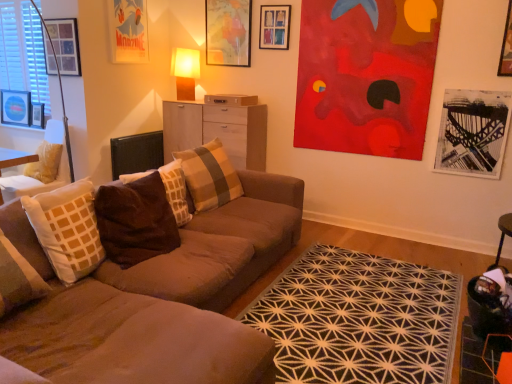
Question: Does wooden picture frame at upper center, the sixth picture frame positioned from the left, have a smaller size compared to velvet cushioned chair at left?

Choices:
 (A) no
 (B) yes

Answer: (B)

Question: From a real-world perspective, is wooden picture frame at upper center, acting as the 2th picture frame starting from the right, on top of velvet cushioned chair at left?

Choices:
 (A) yes
 (B) no

Answer: (A)

Question: Does wooden picture frame at upper center, acting as the 2th picture frame starting from the right, lie in front of velvet cushioned chair at left?

Choices:
 (A) no
 (B) yes

Answer: (A)

Question: Considering the relative positions of wooden picture frame at upper center, the sixth picture frame positioned from the left, and velvet cushioned chair at left in the image provided, is wooden picture frame at upper center, the sixth picture frame positioned from the left, to the left of velvet cushioned chair at left from the viewer's perspective?

Choices:
 (A) no
 (B) yes

Answer: (A)

Question: From the image's perspective, is wooden picture frame at upper center, the sixth picture frame positioned from the left, under velvet cushioned chair at left?

Choices:
 (A) yes
 (B) no

Answer: (B)

Question: From the image's perspective, is matte brown table lamp at upper center positioned above or below brown velvety pillow at center, arranged as the 1th pillow when viewed from the front?

Choices:
 (A) above
 (B) below

Answer: (A)

Question: Is point (181, 64) closer or farther from the camera than point (99, 195)?

Choices:
 (A) closer
 (B) farther

Answer: (B)

Question: Is matte brown table lamp at upper center to the left or to the right of brown velvety pillow at center, arranged as the 1th pillow when viewed from the front, in the image?

Choices:
 (A) right
 (B) left

Answer: (B)

Question: From a real-world perspective, is matte brown table lamp at upper center above or below brown velvety pillow at center, the third pillow when ordered from back to front?

Choices:
 (A) above
 (B) below

Answer: (A)

Question: Is point (13, 104) positioned closer to the camera than point (135, 180)?

Choices:
 (A) closer
 (B) farther

Answer: (B)

Question: Relative to brown velvety pillow at center, placed as the second pillow when sorted from back to front, is brushed metal picture frame at upper left, which ranks as the 7th picture frame in right-to-left order, in front or behind?

Choices:
 (A) front
 (B) behind

Answer: (B)

Question: Is brushed metal picture frame at upper left, which ranks as the 7th picture frame in right-to-left order, bigger or smaller than brown velvety pillow at center, acting as the 2th pillow starting from the front?

Choices:
 (A) big
 (B) small

Answer: (B)

Question: Considering the positions of brushed metal picture frame at upper left, which ranks as the 7th picture frame in right-to-left order, and brown velvety pillow at center, placed as the second pillow when sorted from back to front, in the image, is brushed metal picture frame at upper left, which ranks as the 7th picture frame in right-to-left order, taller or shorter than brown velvety pillow at center, placed as the second pillow when sorted from back to front,?

Choices:
 (A) short
 (B) tall

Answer: (A)

Question: In terms of width, does brown velvety pillow at center, the third pillow when ordered from back to front, look wider or thinner when compared to wooden picture frame at upper center, the sixth picture frame positioned from the left?

Choices:
 (A) wide
 (B) thin

Answer: (A)

Question: From a real-world perspective, relative to wooden picture frame at upper center, acting as the 2th picture frame starting from the right, is brown velvety pillow at center, the third pillow when ordered from back to front, vertically above or below?

Choices:
 (A) above
 (B) below

Answer: (B)